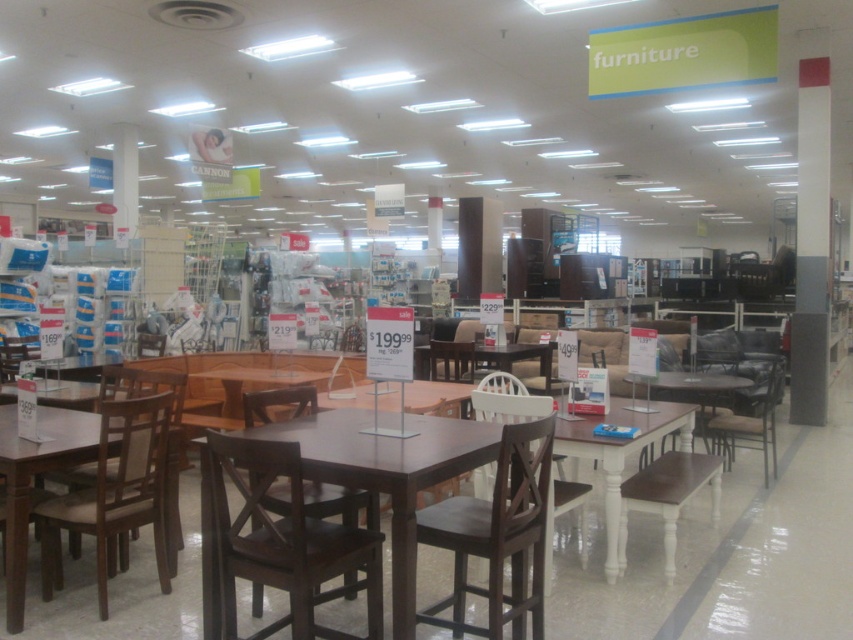
Question: Is dark wood table at center further to the viewer compared to matte brown chair at left?

Choices:
 (A) no
 (B) yes

Answer: (A)

Question: Which of the following is the farthest from the observer?

Choices:
 (A) (163, 582)
 (B) (772, 388)
 (C) (521, 480)

Answer: (B)

Question: Does dark wood table at center appear on the left side of white wood table at center?

Choices:
 (A) yes
 (B) no

Answer: (A)

Question: Estimate the real-world distances between objects in this image. Which object is closer to the dark brown wood chair at center?

Choices:
 (A) matte brown chair at left
 (B) dark wood chair at center
 (C) metallic dark brown chair at right

Answer: (B)

Question: Which of the following is the farthest from the observer?

Choices:
 (A) (726, 384)
 (B) (323, 465)

Answer: (A)

Question: Is dark wood table at center bigger than white wood table at center?

Choices:
 (A) no
 (B) yes

Answer: (B)